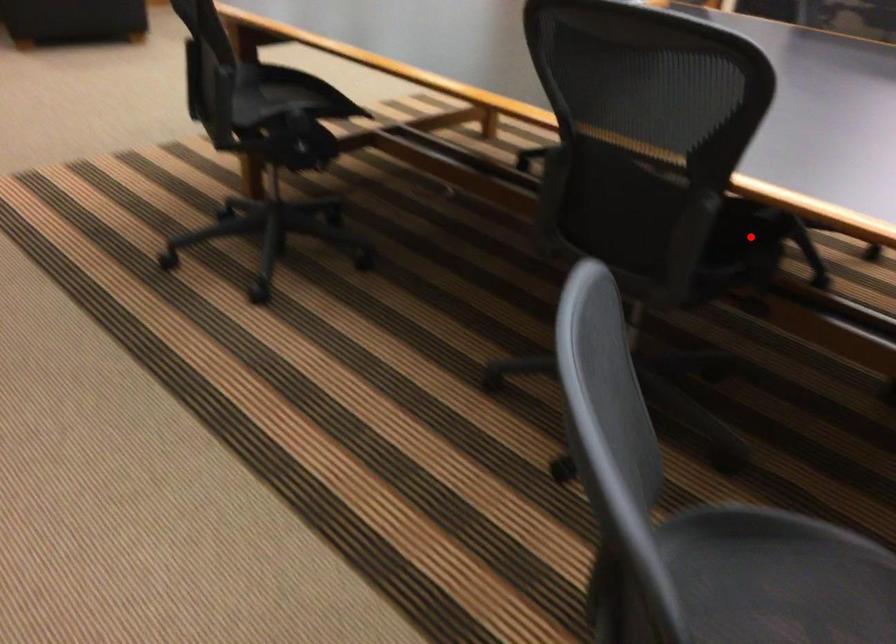
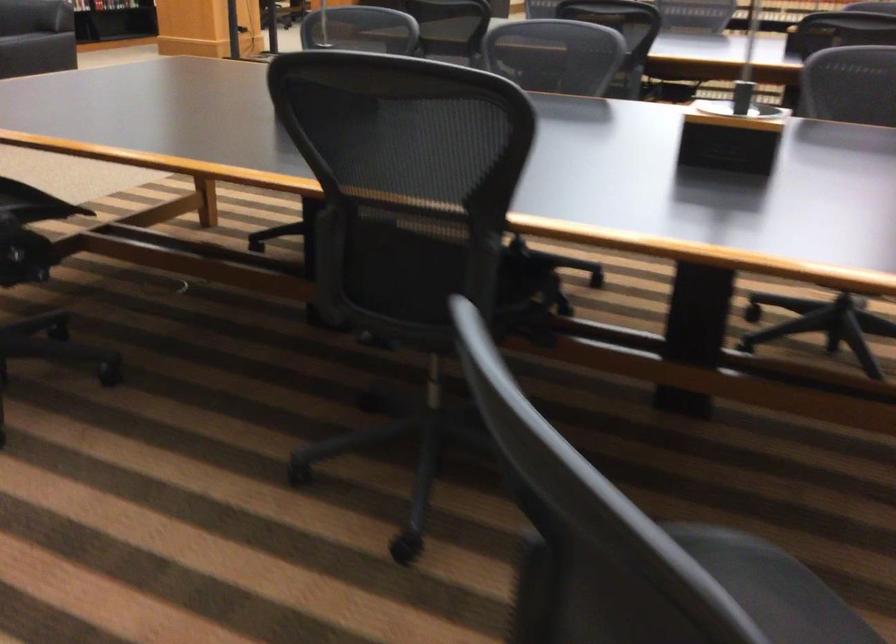
Locate, in the second image, the point that corresponds to the highlighted location in the first image.

(530, 277)